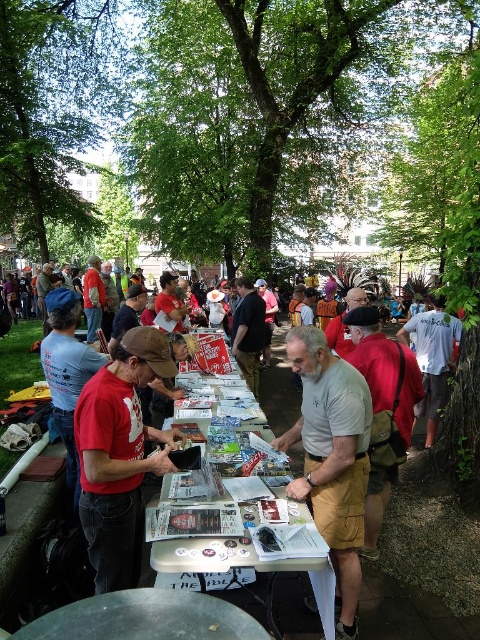
Question: Can you confirm if gray cotton t-shirt at center is positioned to the right of white cotton shirt at center?

Choices:
 (A) yes
 (B) no

Answer: (B)

Question: Which point is farther to the camera?

Choices:
 (A) (356, 408)
 (B) (257, 417)
 (C) (432, 356)
 (D) (153, 467)

Answer: (C)

Question: In this image, where is red cotton shirt at center located relative to white glossy table at center?

Choices:
 (A) left
 (B) right

Answer: (B)

Question: Which point appears closest to the camera in this image?

Choices:
 (A) click(365, 524)
 (B) click(360, 529)

Answer: (B)

Question: Which object appears closest to the camera in this image?

Choices:
 (A) gray cotton t-shirt at center
 (B) white cotton shirt at center

Answer: (A)

Question: Does matte red t-shirt at center have a lesser width compared to white cotton shirt at center?

Choices:
 (A) no
 (B) yes

Answer: (B)